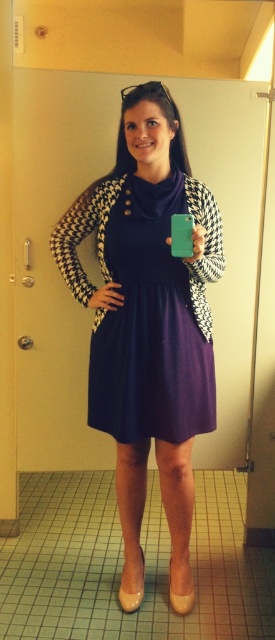
You are organizing a fashion show and need to decide which dress to feature first. Both the matte black dress at center and the purple matte dress at center are options. Based on their widths, which dress should you choose if you want the wider one to be displayed first?

The matte black dress at center is wider than the purple matte dress at center, so you should choose the matte black dress at center to be displayed first.

You are standing in a hallway and see two points marked on the floor. The first point is at coordinate point (127, 116) and the second is at coordinate point (191, 308). Which point is closer to you?

Point (127, 116) is in front of point (191, 308), so it is closer to you.